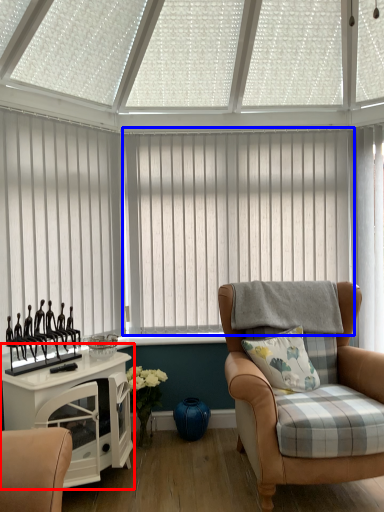
Question: Which object is closer to the camera taking this photo, table (highlighted by a red box) or window blind (highlighted by a blue box)?

Choices:
 (A) table
 (B) window blind

Answer: (A)